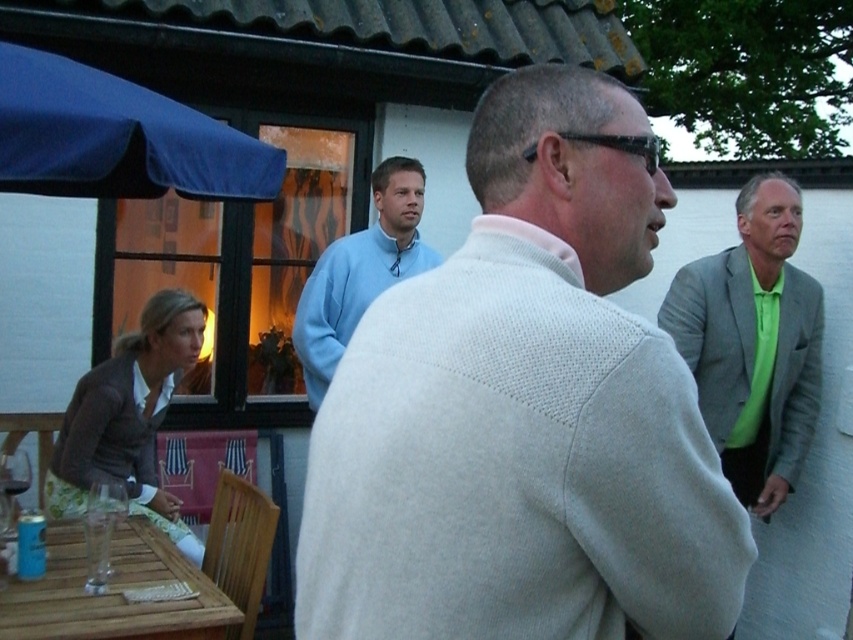
Is light gray sweater at center shorter than wooden table at lower left?

No, light gray sweater at center is not shorter than wooden table at lower left.

Between light gray sweater at center and wooden table at lower left, which one has less height?

wooden table at lower left

This screenshot has height=640, width=853. What do you see at coordinates (524, 412) in the screenshot? I see `light gray sweater at center` at bounding box center [524, 412].

Where is `light gray sweater at center`? Image resolution: width=853 pixels, height=640 pixels. light gray sweater at center is located at coordinates (524, 412).

Which is behind, point (7, 611) or point (386, 189)?

Positioned behind is point (386, 189).

Is point (73, 577) farther from viewer compared to point (358, 292)?

No, it is not.

Is point (113, 598) positioned before point (436, 256)?

Yes, point (113, 598) is in front of point (436, 256).

The image size is (853, 640). What are the coordinates of `wooden table at lower left` in the screenshot? It's located at (112, 593).

Is light gray wool sweater at right to the left of wooden table at lower left from the viewer's perspective?

In fact, light gray wool sweater at right is to the right of wooden table at lower left.

Which is in front, point (798, 337) or point (49, 609)?

Point (49, 609) is more forward.

Who is more forward, (712,358) or (207,612)?

Point (207,612) is more forward.

Where is `light gray wool sweater at right`? This screenshot has height=640, width=853. light gray wool sweater at right is located at coordinates (715, 333).